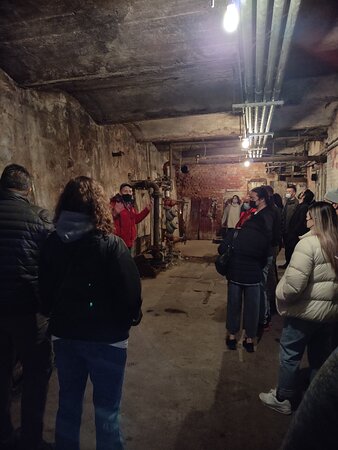
Find the location of a particular element. The image size is (338, 450). concrete flooring is located at coordinates (178, 357).